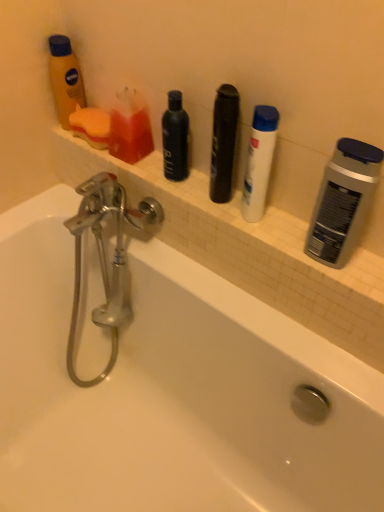
Question: From a real-world perspective, does white matte shampoo at center, the third toiletry in the left-to-right sequence, sit lower than translucent plastic soap at upper left, positioned as the 2th toiletry in left-to-right order?

Choices:
 (A) no
 (B) yes

Answer: (A)

Question: Considering the relative sizes of white matte shampoo at center, the third toiletry in the left-to-right sequence, and translucent plastic soap at upper left, placed as the second toiletry when sorted from right to left, in the image provided, is white matte shampoo at center, the third toiletry in the left-to-right sequence, wider than translucent plastic soap at upper left, placed as the second toiletry when sorted from right to left,?

Choices:
 (A) no
 (B) yes

Answer: (A)

Question: Is white matte shampoo at center, positioned as the first toiletry in right-to-left order, directly adjacent to translucent plastic soap at upper left, placed as the second toiletry when sorted from right to left?

Choices:
 (A) no
 (B) yes

Answer: (A)

Question: Considering the relative sizes of white matte shampoo at center, the third toiletry in the left-to-right sequence, and translucent plastic soap at upper left, positioned as the 2th toiletry in left-to-right order, in the image provided, is white matte shampoo at center, the third toiletry in the left-to-right sequence, bigger than translucent plastic soap at upper left, positioned as the 2th toiletry in left-to-right order,?

Choices:
 (A) no
 (B) yes

Answer: (B)

Question: Does white matte shampoo at center, the third toiletry in the left-to-right sequence, have a greater height compared to translucent plastic soap at upper left, positioned as the 2th toiletry in left-to-right order?

Choices:
 (A) no
 (B) yes

Answer: (B)

Question: Relative to silver metallic deodorant at right, placed as the first personal care when sorted from right to left, is beige tile ledge at upper center in front or behind?

Choices:
 (A) behind
 (B) front

Answer: (A)

Question: From the image's perspective, is beige tile ledge at upper center positioned above or below silver metallic deodorant at right, placed as the 2th personal care when sorted from back to front?

Choices:
 (A) below
 (B) above

Answer: (B)

Question: From their relative heights in the image, would you say beige tile ledge at upper center is taller or shorter than silver metallic deodorant at right, arranged as the first personal care when viewed from the front?

Choices:
 (A) tall
 (B) short

Answer: (B)

Question: Is beige tile ledge at upper center to the left or to the right of silver metallic deodorant at right, placed as the first personal care when sorted from right to left, in the image?

Choices:
 (A) right
 (B) left

Answer: (B)

Question: Is matte orange lotion at upper left, marked as the third toiletry in a right-to-left arrangement, to the left or to the right of beige tile ledge at upper center in the image?

Choices:
 (A) left
 (B) right

Answer: (A)

Question: Considering their positions, is matte orange lotion at upper left, marked as the third toiletry in a right-to-left arrangement, located in front of or behind beige tile ledge at upper center?

Choices:
 (A) behind
 (B) front

Answer: (A)

Question: Is matte orange lotion at upper left, which is the 1th toiletry in left-to-right order, inside the boundaries of beige tile ledge at upper center, or outside?

Choices:
 (A) outside
 (B) inside

Answer: (A)

Question: Is matte orange lotion at upper left, marked as the third toiletry in a right-to-left arrangement, wider or thinner than beige tile ledge at upper center?

Choices:
 (A) wide
 (B) thin

Answer: (B)

Question: From a real-world perspective, relative to matte orange lotion at upper left, marked as the third toiletry in a right-to-left arrangement, is white matte shampoo at center, the third toiletry in the left-to-right sequence, vertically above or below?

Choices:
 (A) above
 (B) below

Answer: (A)

Question: Does point (269, 138) appear closer or farther from the camera than point (64, 39)?

Choices:
 (A) farther
 (B) closer

Answer: (B)